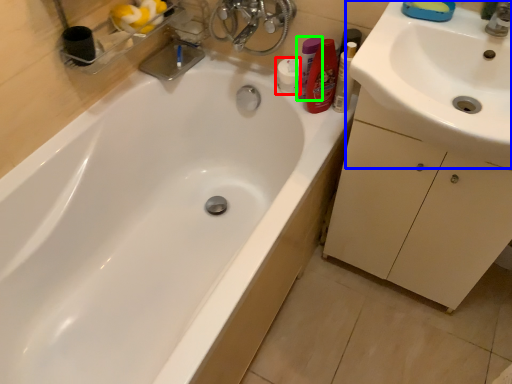
Question: Estimate the real-world distances between objects in this image. Which object is farther from toiletry (highlighted by a red box), sink (highlighted by a blue box) or toiletry (highlighted by a green box)?

Choices:
 (A) sink
 (B) toiletry

Answer: (A)